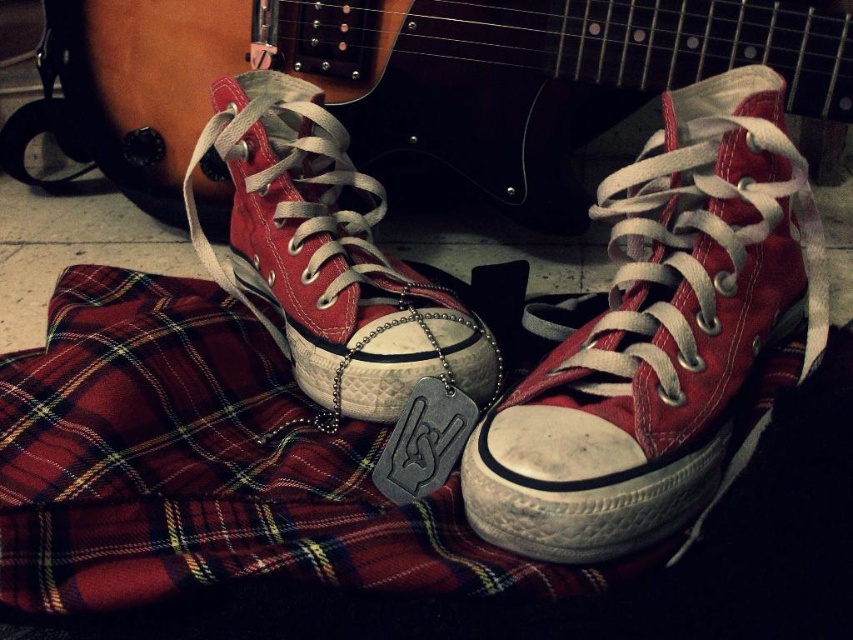
Question: Is matte canvas sneaker at center bigger than matte canvas shoe at center?

Choices:
 (A) yes
 (B) no

Answer: (B)

Question: Is the position of matte canvas sneaker at center less distant than that of matte canvas shoe at center?

Choices:
 (A) yes
 (B) no

Answer: (A)

Question: Which object appears farthest from the camera in this image?

Choices:
 (A) matte canvas shoe at center
 (B) matte canvas sneaker at center

Answer: (A)

Question: Which point is farther from the camera taking this photo?

Choices:
 (A) (637, 317)
 (B) (274, 198)

Answer: (B)

Question: Can you confirm if matte canvas sneaker at center is smaller than matte canvas shoe at center?

Choices:
 (A) yes
 (B) no

Answer: (A)